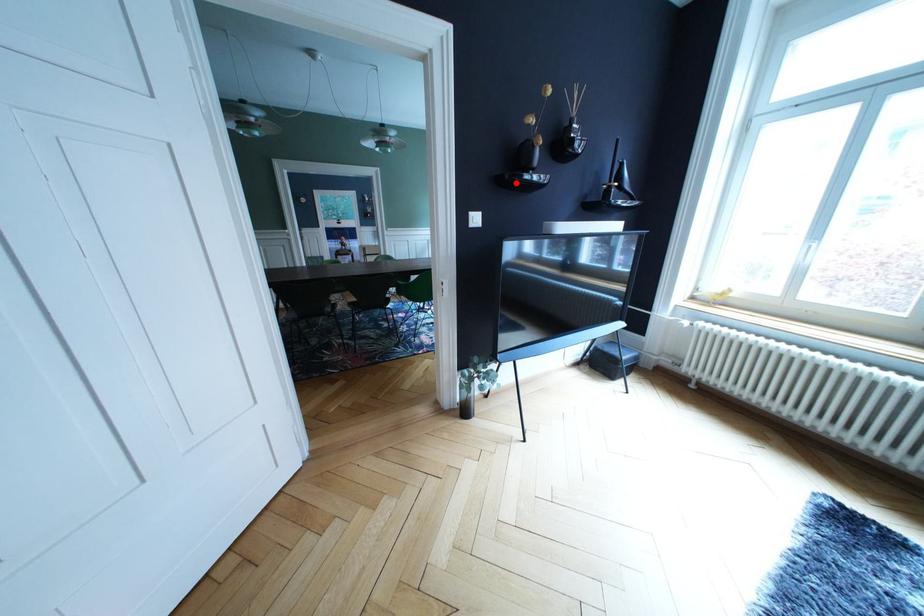
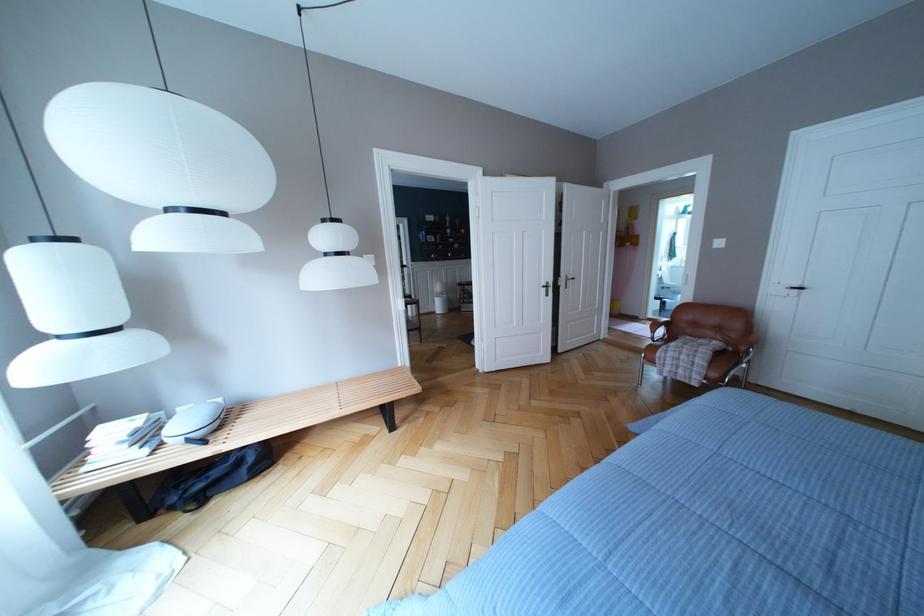
Question: I am providing you with two images of the same scene from different viewpoints. A red point is marked on the first image. At the location where the point appears in image 1, is it still visible in image 2?

Choices:
 (A) Yes
 (B) No

Answer: (B)